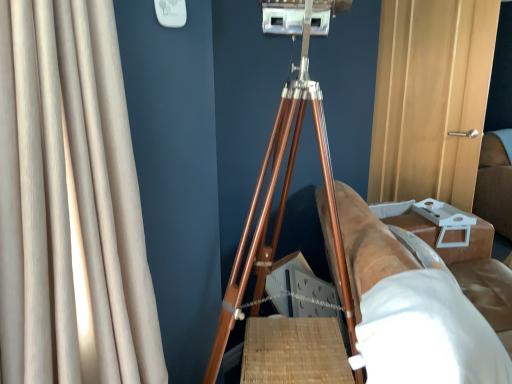
Question: Do you think brown leather couch at right is within beige fabric curtain at left, or outside of it?

Choices:
 (A) inside
 (B) outside

Answer: (B)

Question: Based on their positions, is brown leather couch at right located to the left or right of beige fabric curtain at left?

Choices:
 (A) left
 (B) right

Answer: (B)

Question: Based on their relative distances, which object is farther from the wooden tripod at center?

Choices:
 (A) brown leather couch at right
 (B) brown leather couch at right
 (C) white matte sheet at lower right
 (D) beige fabric curtain at left

Answer: (B)

Question: Which of these objects is positioned farthest from the wooden tripod at center?

Choices:
 (A) beige fabric curtain at left
 (B) white matte sheet at lower right
 (C) brown leather couch at right
 (D) brown leather couch at right

Answer: (C)